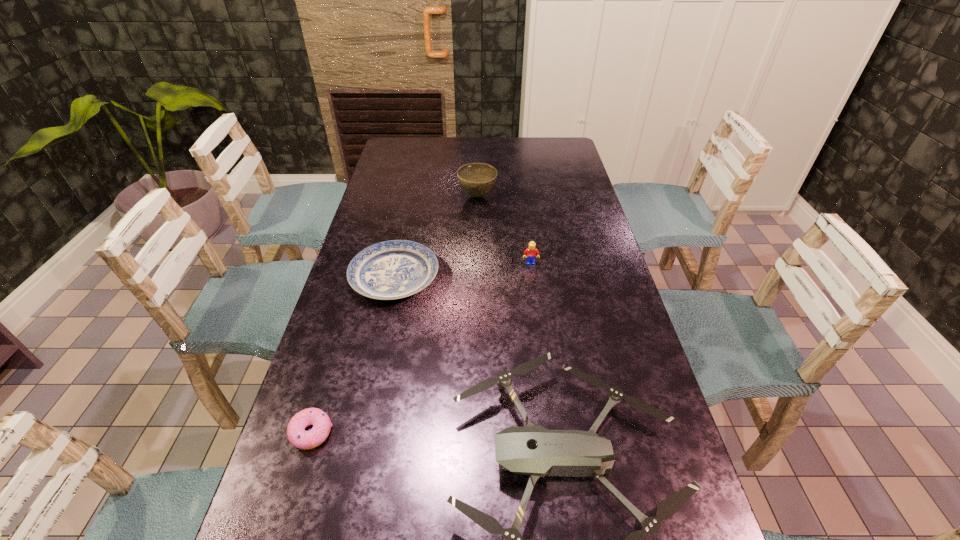
Identify the location of bowl. This screenshot has height=540, width=960. (477, 179).

Locate an element on the screen. the farthest object is located at coordinates (477, 179).

This screenshot has width=960, height=540. I want to click on Lego, so click(531, 253).

What are the coordinates of `plate` in the screenshot? It's located at (394, 269).

Locate an element on the screen. This screenshot has width=960, height=540. doughnut is located at coordinates (297, 436).

Where is `free spot located on the back of the farthest object`? free spot located on the back of the farthest object is located at coordinates (478, 150).

Identify the location of vacant space positioned on the front-facing side of the Lego. The image size is (960, 540). (539, 327).

The width and height of the screenshot is (960, 540). What are the coordinates of `vacant space located 0.250m on the front of the plate` in the screenshot? It's located at (372, 384).

The width and height of the screenshot is (960, 540). In order to click on vacant space situated on the right of the doughnut in this screenshot , I will do `click(464, 433)`.

Locate an element on the screen. Image resolution: width=960 pixels, height=540 pixels. plate positioned at the left edge is located at coordinates (394, 269).